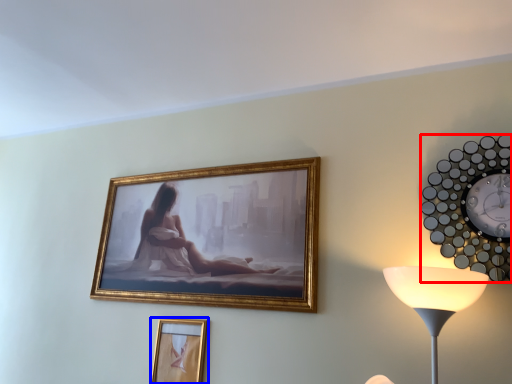
Question: Which object is further to the camera taking this photo, wall clock (highlighted by a red box) or picture frame (highlighted by a blue box)?

Choices:
 (A) wall clock
 (B) picture frame

Answer: (B)